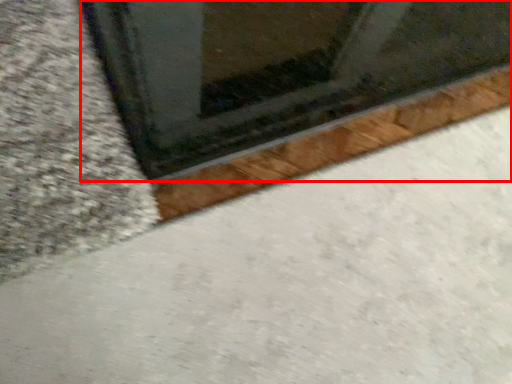
Question: In this image, where is window (annotated by the red box) located relative to concrete?

Choices:
 (A) left
 (B) right

Answer: (B)